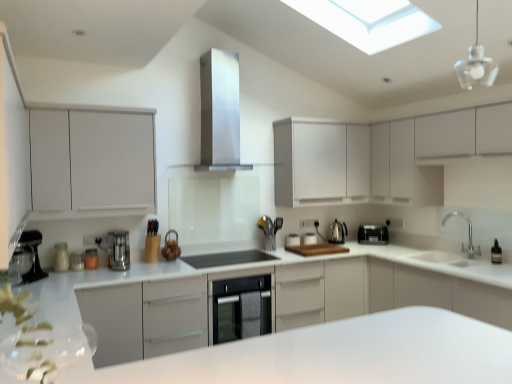
Question: From the image's perspective, is white matte cabinet at left, which is the fourth cabinetry from right to left, located above white glossy toaster at center, positioned as the 7th appliance in left-to-right order?

Choices:
 (A) yes
 (B) no

Answer: (A)

Question: From the image's perspective, is white matte cabinet at left, the 1th cabinetry viewed from the left, below white glossy toaster at center, positioned as the 7th appliance in left-to-right order?

Choices:
 (A) yes
 (B) no

Answer: (B)

Question: Are white matte cabinet at left, the 1th cabinetry viewed from the left, and white glossy toaster at center, which is the 2th appliance in right-to-left order, located far from each other?

Choices:
 (A) no
 (B) yes

Answer: (B)

Question: Is white matte cabinet at left, the 1th cabinetry viewed from the left, facing towards white glossy toaster at center, positioned as the 7th appliance in left-to-right order?

Choices:
 (A) no
 (B) yes

Answer: (A)

Question: Is white matte cabinet at left, the 1th cabinetry viewed from the left, beside white glossy toaster at center, which is the 2th appliance in right-to-left order?

Choices:
 (A) yes
 (B) no

Answer: (B)

Question: From a real-world perspective, is white matte cabinet at left, the 1th cabinetry viewed from the left, under white glossy toaster at center, positioned as the 7th appliance in left-to-right order?

Choices:
 (A) no
 (B) yes

Answer: (A)

Question: Can we say metallic silver coffee maker at left, the 8th appliance when ordered from right to left, lies outside satin silver coffee maker at center, which is counted as the 1th kitchen appliance, starting from the front?

Choices:
 (A) no
 (B) yes

Answer: (B)

Question: Is the position of metallic silver coffee maker at left, which ranks as the 1th appliance in left-to-right order, more distant than that of satin silver coffee maker at center, the 2th kitchen appliance viewed from the right?

Choices:
 (A) no
 (B) yes

Answer: (A)

Question: Is metallic silver coffee maker at left, which ranks as the 1th appliance in left-to-right order, oriented towards satin silver coffee maker at center, the first kitchen appliance from the left?

Choices:
 (A) yes
 (B) no

Answer: (B)

Question: From a real-world perspective, is metallic silver coffee maker at left, the 8th appliance when ordered from right to left, on top of satin silver coffee maker at center, which is the 2th kitchen appliance from back to front?

Choices:
 (A) no
 (B) yes

Answer: (A)

Question: Does metallic silver coffee maker at left, the 8th appliance when ordered from right to left, lie in front of satin silver coffee maker at center, the first kitchen appliance from the left?

Choices:
 (A) yes
 (B) no

Answer: (A)

Question: From the image's perspective, is metallic silver coffee maker at left, which ranks as the 1th appliance in left-to-right order, above satin silver coffee maker at center, which is counted as the 1th kitchen appliance, starting from the front?

Choices:
 (A) no
 (B) yes

Answer: (A)

Question: Would you say metallic silver coffee maker at left, which ranks as the 1th appliance in left-to-right order, is outside metallic silver toaster at lower left, arranged as the third appliance when viewed from the left?

Choices:
 (A) yes
 (B) no

Answer: (A)